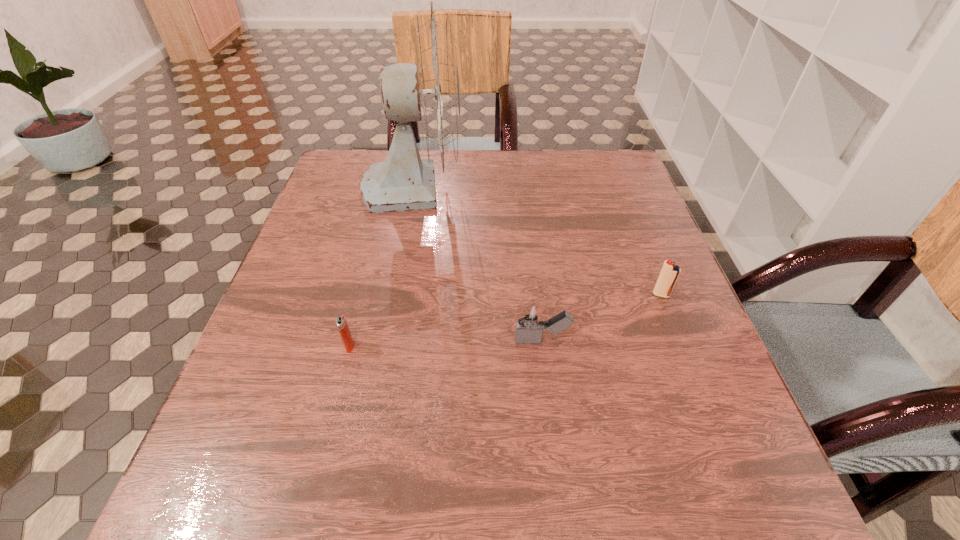
Find the location of a particular element. The width and height of the screenshot is (960, 540). object present at the far edge is located at coordinates (428, 91).

In order to click on object that is at the left edge in this screenshot , I will do `click(428, 91)`.

The height and width of the screenshot is (540, 960). What are the coordinates of `object positioned at the right edge` in the screenshot? It's located at (669, 274).

Find the location of a particular element. This screenshot has width=960, height=540. object situated at the far left corner is located at coordinates (428, 91).

The image size is (960, 540). Find the location of `free space at the far edge`. free space at the far edge is located at coordinates (545, 178).

Locate an element on the screen. This screenshot has height=540, width=960. vacant space at the near edge of the desktop is located at coordinates (530, 500).

Image resolution: width=960 pixels, height=540 pixels. Identify the location of vacant region at the left edge of the desktop. (324, 207).

In order to click on free spot at the right edge of the desktop in this screenshot , I will do `click(600, 227)`.

The image size is (960, 540). Identify the location of vacant space at the far left corner of the desktop. (341, 173).

The image size is (960, 540). In order to click on free space at the near left corner in this screenshot , I will do pos(197,468).